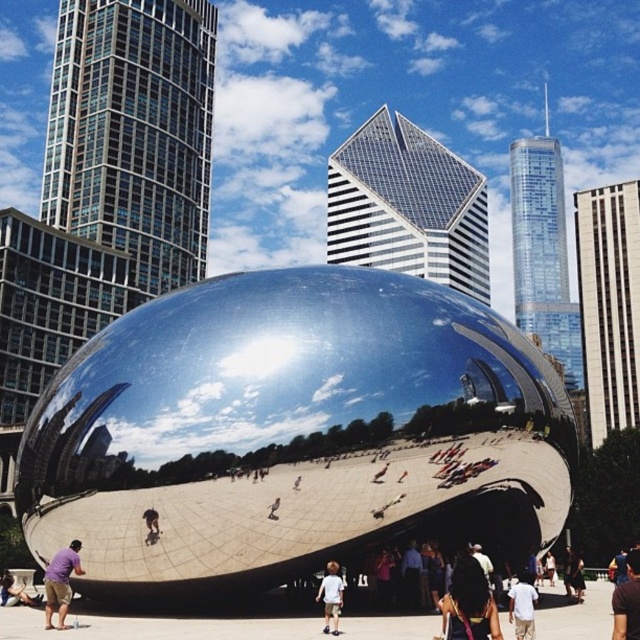
Question: Which of these objects is positioned farthest from the purple cotton shirt at lower left?

Choices:
 (A) white cotton shirt at lower center
 (B) white cotton shirt at center

Answer: (A)

Question: Which object appears closest to the camera in this image?

Choices:
 (A) purple cotton shirt at lower left
 (B) white cotton shirt at lower center
 (C) dark brown hair at center
 (D) brown fabric shirt at lower right

Answer: (D)

Question: Does purple cotton shirt at lower left have a greater width compared to white cotton shirt at center?

Choices:
 (A) yes
 (B) no

Answer: (A)

Question: Is purple cotton shirt at lower left bigger than white cotton shirt at center?

Choices:
 (A) yes
 (B) no

Answer: (B)

Question: Does dark brown hair at center appear on the right side of white cotton shirt at center?

Choices:
 (A) no
 (B) yes

Answer: (B)

Question: Estimate the real-world distances between objects in this image. Which object is closer to the purple cotton shirt at lower left?

Choices:
 (A) brown fabric shirt at lower right
 (B) white cotton shirt at lower center
 (C) dark brown hair at center
 (D) white cotton shirt at center

Answer: (D)